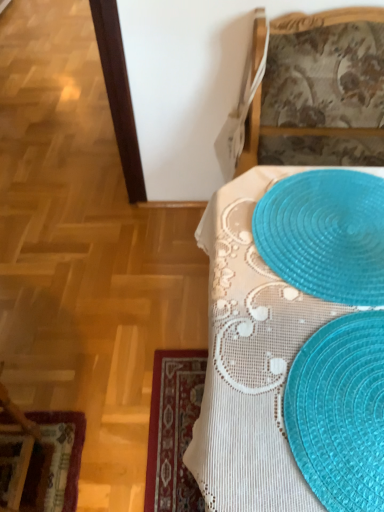
The width and height of the screenshot is (384, 512). I want to click on vacant space in front of translucent plastic placemat at upper right, so click(x=305, y=382).